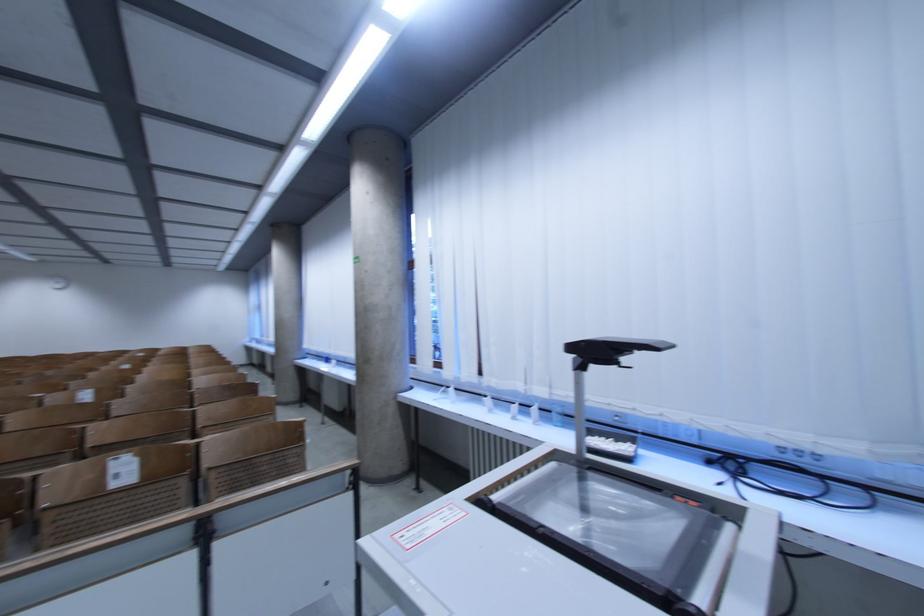
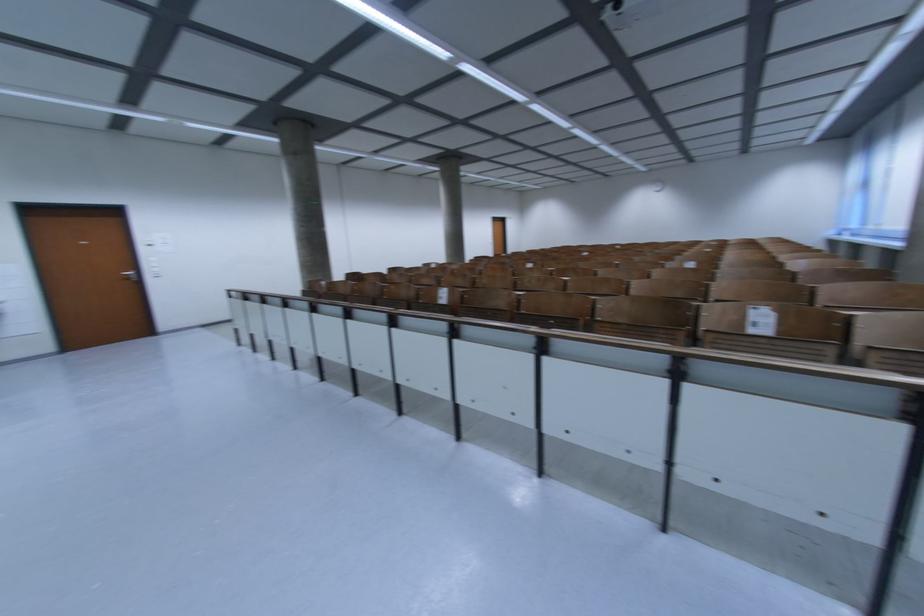
Question: The camera is either moving clockwise (left) or counter-clockwise (right) around the object. The first image is from the beginning of the video and the second image is from the end. Is the camera moving left or right when shooting the video?

Choices:
 (A) Left
 (B) Right

Answer: (B)